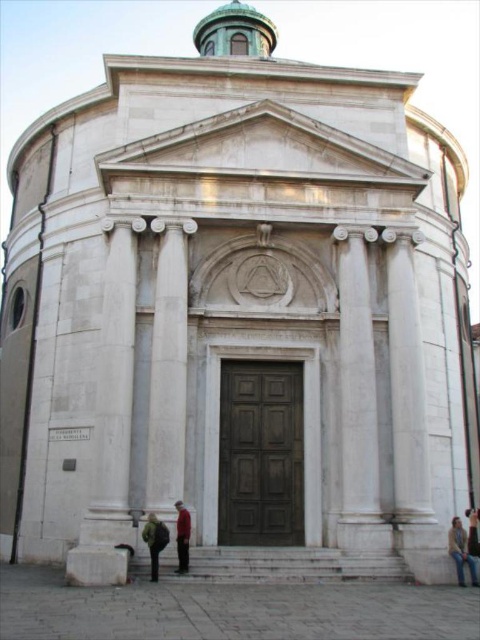
Question: Which of the following is the closest to the observer?

Choices:
 (A) (459, 579)
 (B) (350, 438)

Answer: (A)

Question: Which point is closer to the camera?

Choices:
 (A) light brown leather jacket at lower right
 (B) white marble column at center
 (C) red fabric coat at lower center
 (D) green fuzzy coat at lower center

Answer: (D)

Question: In this image, where is white marble stairs at center located relative to green fuzzy coat at lower center?

Choices:
 (A) below
 (B) above

Answer: (A)

Question: Is green fuzzy coat at lower center to the right of red fabric coat at lower center from the viewer's perspective?

Choices:
 (A) yes
 (B) no

Answer: (B)

Question: Does white marble column at center have a smaller size compared to light brown leather jacket at lower right?

Choices:
 (A) yes
 (B) no

Answer: (B)

Question: Which object is the closest to the green fuzzy coat at lower center?

Choices:
 (A) red fabric coat at lower center
 (B) light brown leather jacket at lower right
 (C) white marble stairs at center
 (D) white marble column at center

Answer: (A)